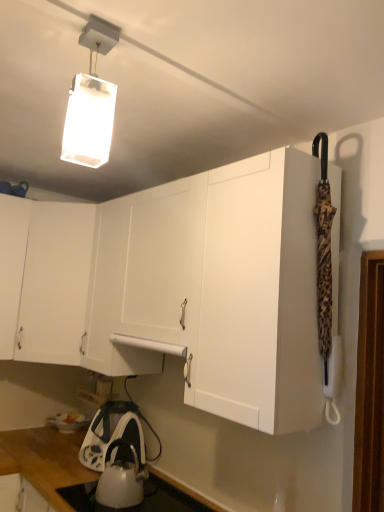
Question: From the image's perspective, would you say white glossy kettle at lower center is shown under white matte rectangular light fixture at upper center?

Choices:
 (A) yes
 (B) no

Answer: (A)

Question: Is white glossy kettle at lower center wider than white matte rectangular light fixture at upper center?

Choices:
 (A) no
 (B) yes

Answer: (B)

Question: Is white glossy kettle at lower center oriented away from white matte rectangular light fixture at upper center?

Choices:
 (A) yes
 (B) no

Answer: (B)

Question: Does white glossy kettle at lower center have a lesser width compared to white matte rectangular light fixture at upper center?

Choices:
 (A) no
 (B) yes

Answer: (A)

Question: Is white glossy kettle at lower center smaller than white matte rectangular light fixture at upper center?

Choices:
 (A) yes
 (B) no

Answer: (B)

Question: Is white glossy kettle at lower center aimed at white matte rectangular light fixture at upper center?

Choices:
 (A) no
 (B) yes

Answer: (A)

Question: Does white matte rectangular light fixture at upper center lie behind white glossy kettle at lower center?

Choices:
 (A) no
 (B) yes

Answer: (A)

Question: From a real-world perspective, is white matte rectangular light fixture at upper center physically above white glossy kettle at lower center?

Choices:
 (A) no
 (B) yes

Answer: (B)

Question: Considering the relative sizes of white matte rectangular light fixture at upper center and white glossy kettle at lower center in the image provided, is white matte rectangular light fixture at upper center smaller than white glossy kettle at lower center?

Choices:
 (A) no
 (B) yes

Answer: (B)

Question: Is white matte rectangular light fixture at upper center positioned before white glossy kettle at lower center?

Choices:
 (A) no
 (B) yes

Answer: (B)

Question: Can you confirm if white matte rectangular light fixture at upper center is positioned to the right of white glossy kettle at lower center?

Choices:
 (A) yes
 (B) no

Answer: (A)

Question: Is white glossy kettle at lower center at the back of white matte rectangular light fixture at upper center?

Choices:
 (A) yes
 (B) no

Answer: (B)

Question: From the image's perspective, would you say white matte cabinet at upper left is positioned over white matte rectangular light fixture at upper center?

Choices:
 (A) no
 (B) yes

Answer: (A)